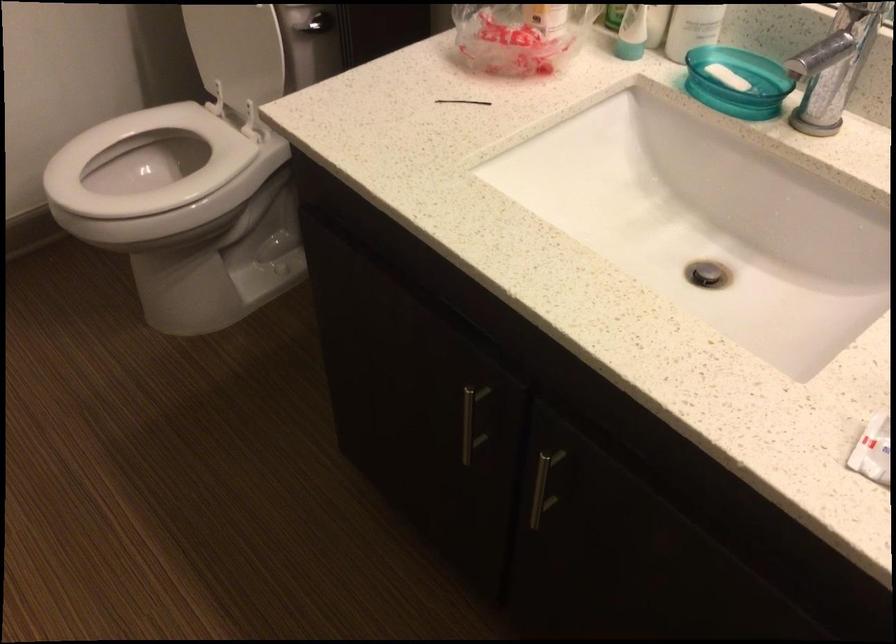
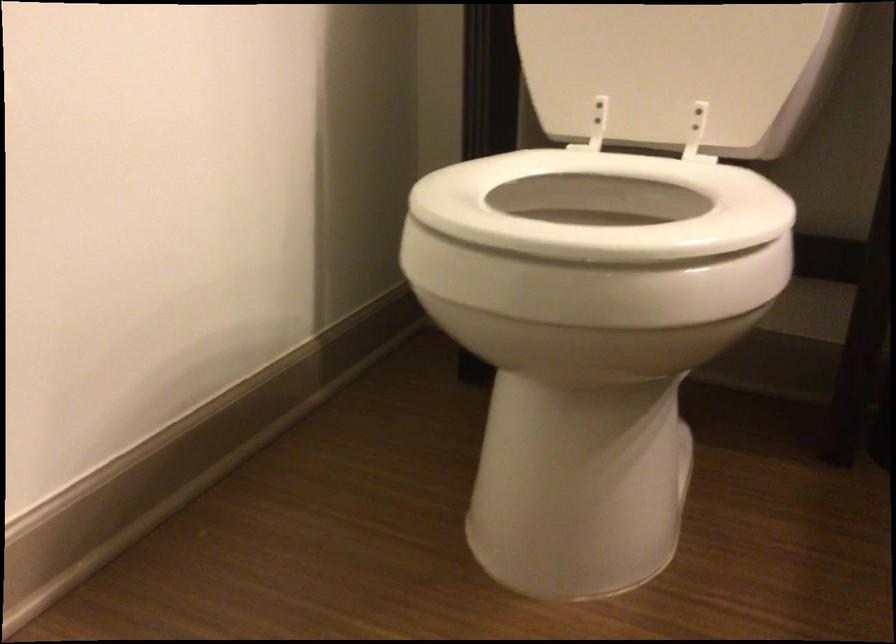
Where in the second image is the point corresponding to point 239,73 from the first image?

(677, 71)